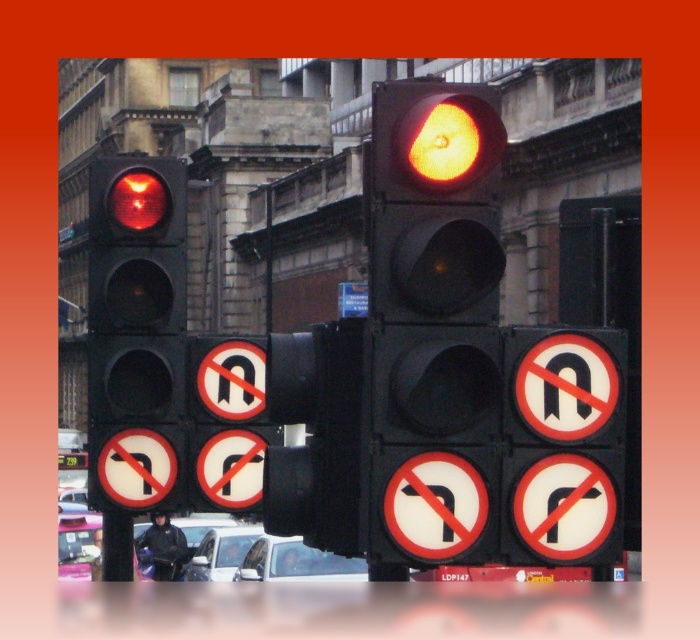
You are a driver approaching an intersection with a matte black traffic light at center and a white circular sign at center. Which object would appear larger to you as you look at them from your car?

The white circular sign at center appears larger than the matte black traffic light at center because the traffic light is smaller in size compared to the sign.

You are a driver approaching an intersection with two traffic lights. The first is the matte black traffic light at center, and the second is the matte black traffic light at left. Which traffic light should you pay attention to for your direction?

The matte black traffic light at left is taller than the matte black traffic light at center. Since traffic lights are typically positioned based on their relevance to lanes, the taller one on the left might be for the left lane, so you should follow the matte black traffic light at left if you are in the left lane.